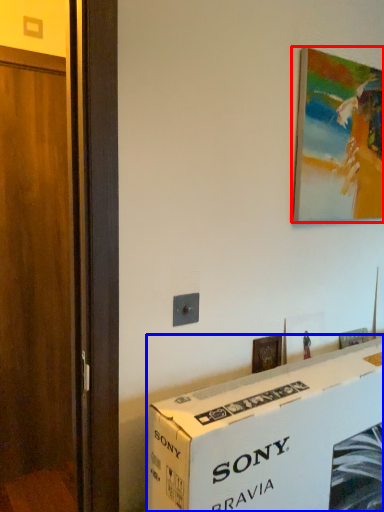
Question: Among these objects, which one is nearest to the camera, picture frame (highlighted by a red box) or box (highlighted by a blue box)?

Choices:
 (A) picture frame
 (B) box

Answer: (B)